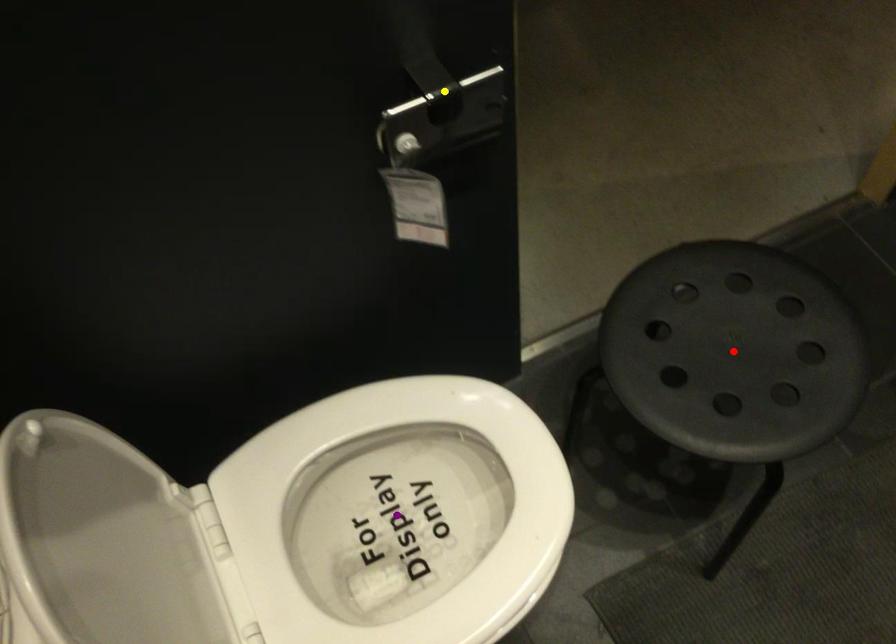
Order these from nearest to farthest:
A) yellow point
B) red point
C) purple point

yellow point, red point, purple point